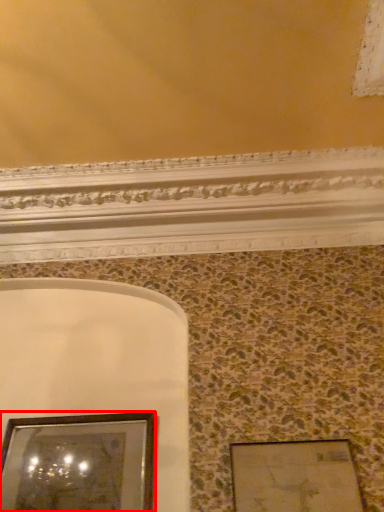
Question: From the image's perspective, what is the correct spatial positioning of picture frame (annotated by the red box) in reference to picture frame?

Choices:
 (A) above
 (B) below

Answer: (B)